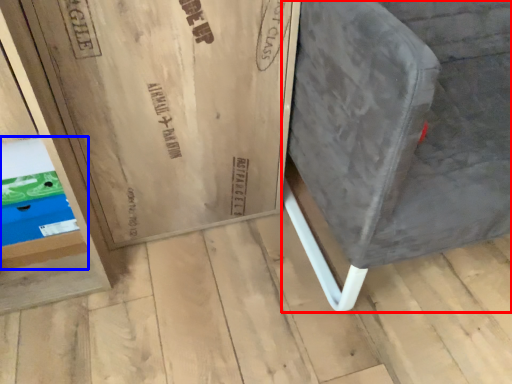
Question: Among these objects, which one is farthest to the camera, furniture (highlighted by a red box) or shelf (highlighted by a blue box)?

Choices:
 (A) furniture
 (B) shelf

Answer: (B)